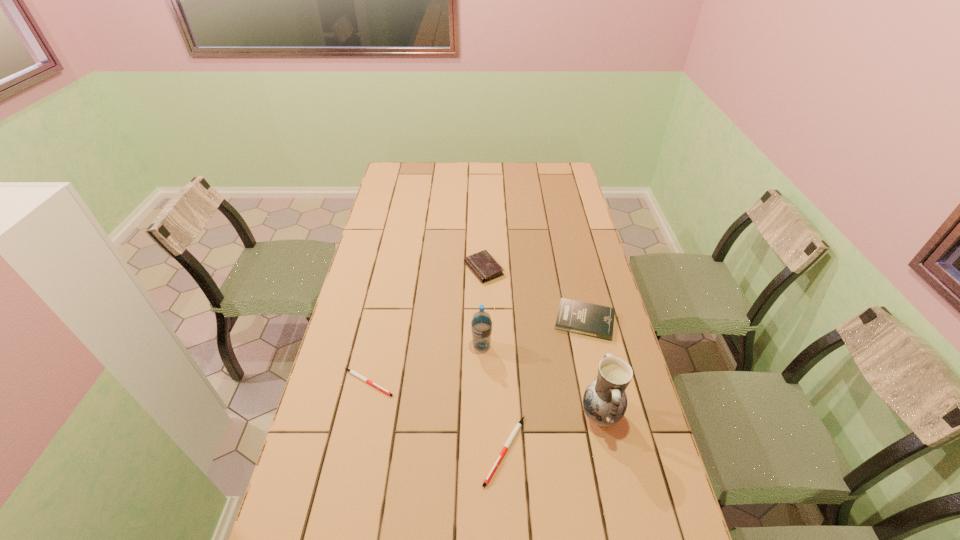
Identify the location of the farther pen. The width and height of the screenshot is (960, 540). coord(352,372).

I want to click on the leftmost object, so click(352, 372).

I want to click on the right pen, so click(x=517, y=427).

Find the location of a particular element. This screenshot has width=960, height=540. the taller pen is located at coordinates (517, 427).

The image size is (960, 540). Find the location of `the farthest object`. the farthest object is located at coordinates 482,264.

Image resolution: width=960 pixels, height=540 pixels. Identify the location of the fifth shortest object. [481, 326].

You are a GUI agent. You are given a task and a screenshot of the screen. Output one action in this format:
    pyautogui.click(x=<x>, y=<y>)
    Task: Click on the book
    The width and height of the screenshot is (960, 540).
    Given the screenshot: What is the action you would take?
    pyautogui.click(x=587, y=319)

At what (x,y) coordinates should I click in order to perform the action: click on pottery. Please return your answer as a coordinate pair (x, y). Looking at the image, I should click on (605, 402).

Identify the location of free region located on the clicker of the leftmost object. The image size is (960, 540). point(439,382).

I want to click on blank space located 0.070m on the clicker of the nearer pen, so pyautogui.click(x=508, y=519).